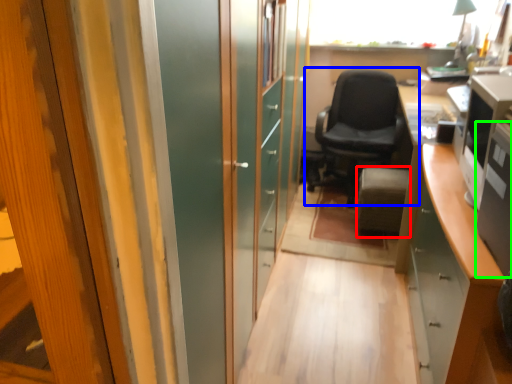
Question: Which object is positioned closest to furniture (highlighted by a red box)? Select from chair (highlighted by a blue box) and desktop computer (highlighted by a green box).

Choices:
 (A) chair
 (B) desktop computer

Answer: (A)